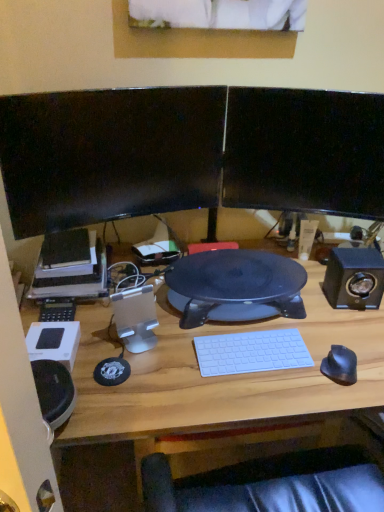
The image size is (384, 512). I want to click on vacant space situated on the left part of black matte mouse at right, so (x=281, y=389).